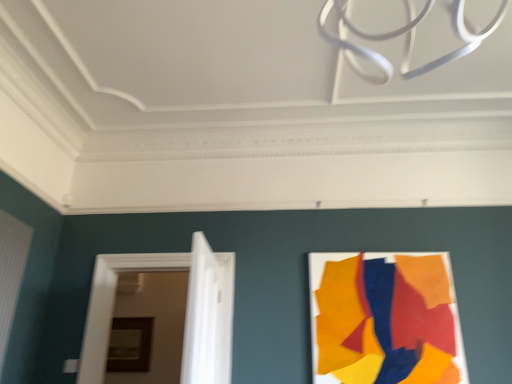
Question: Relative to white glossy door at center, marked as the second door in a back-to-front arrangement, is matte acrylic poster at right in front or behind?

Choices:
 (A) front
 (B) behind

Answer: (B)

Question: From a real-world perspective, is matte acrylic poster at right physically located above or below white glossy door at center, marked as the second door in a back-to-front arrangement?

Choices:
 (A) above
 (B) below

Answer: (A)

Question: Estimate the real-world distances between objects in this image. Which object is closer to the wooden picture frame at center?

Choices:
 (A) white glossy door at center, marked as the second door in a back-to-front arrangement
 (B) matte acrylic poster at right
 (C) white painted wood door at left, acting as the first door starting from the back

Answer: (C)

Question: Which is nearer to the white painted wood door at left, acting as the first door starting from the back?

Choices:
 (A) matte acrylic poster at right
 (B) white glossy door at center, marked as the second door in a back-to-front arrangement
 (C) wooden picture frame at center

Answer: (B)